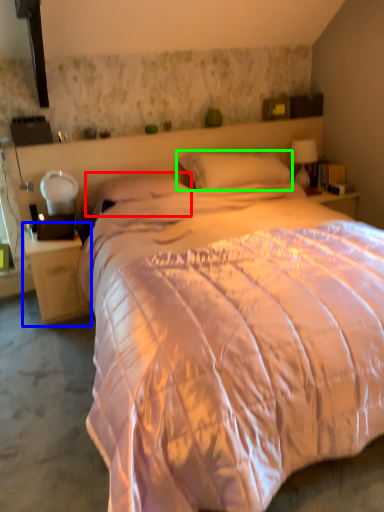
Question: Based on their relative distances, which object is farther from pillow (highlighted by a red box)? Choose from nightstand (highlighted by a blue box) and pillow (highlighted by a green box).

Choices:
 (A) nightstand
 (B) pillow

Answer: (A)